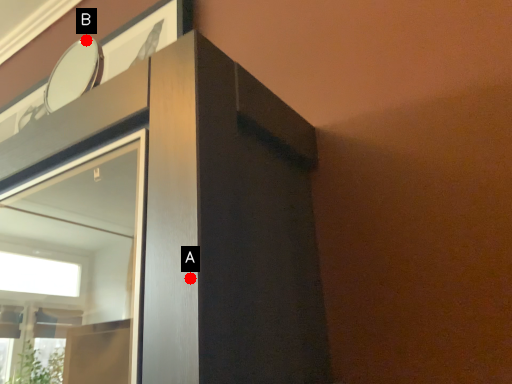
Question: Two points are circled on the image, labeled by A and B beside each circle. Among these points, which one is nearest to the camera?

Choices:
 (A) A is closer
 (B) B is closer

Answer: (A)